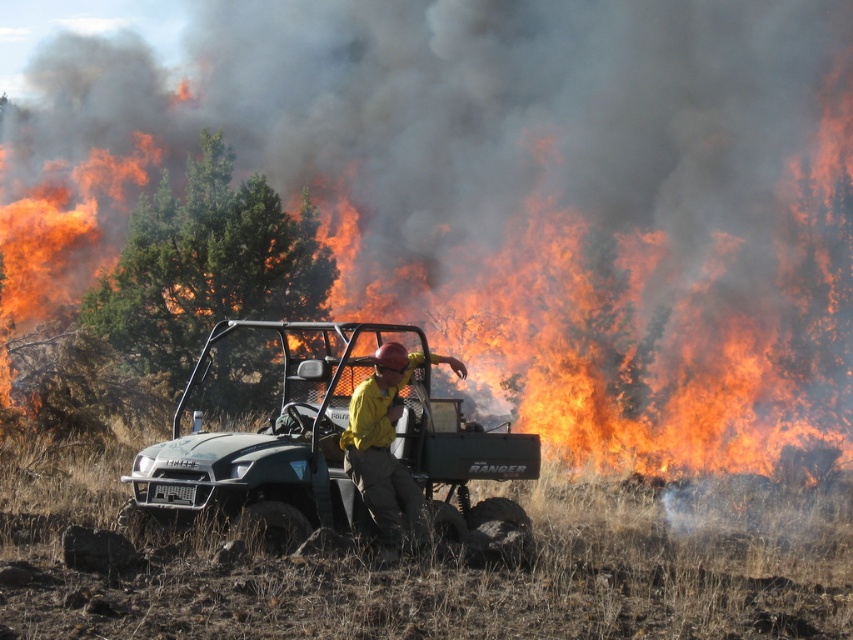
Question: Can you confirm if green matte utility vehicle at center is thinner than yellow fire-resistant suit at center?

Choices:
 (A) yes
 (B) no

Answer: (B)

Question: Which object appears farthest from the camera in this image?

Choices:
 (A) yellow fire-resistant suit at center
 (B) green matte utility vehicle at center

Answer: (B)

Question: Is green matte utility vehicle at center positioned at the back of yellow fire-resistant suit at center?

Choices:
 (A) no
 (B) yes

Answer: (B)

Question: Can you confirm if green matte utility vehicle at center is positioned to the left of yellow fire-resistant suit at center?

Choices:
 (A) yes
 (B) no

Answer: (A)